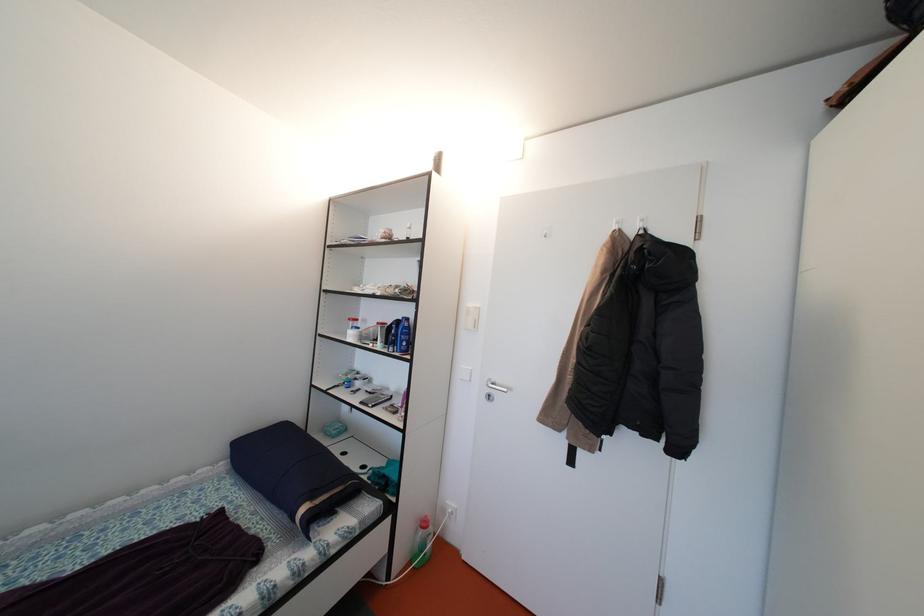
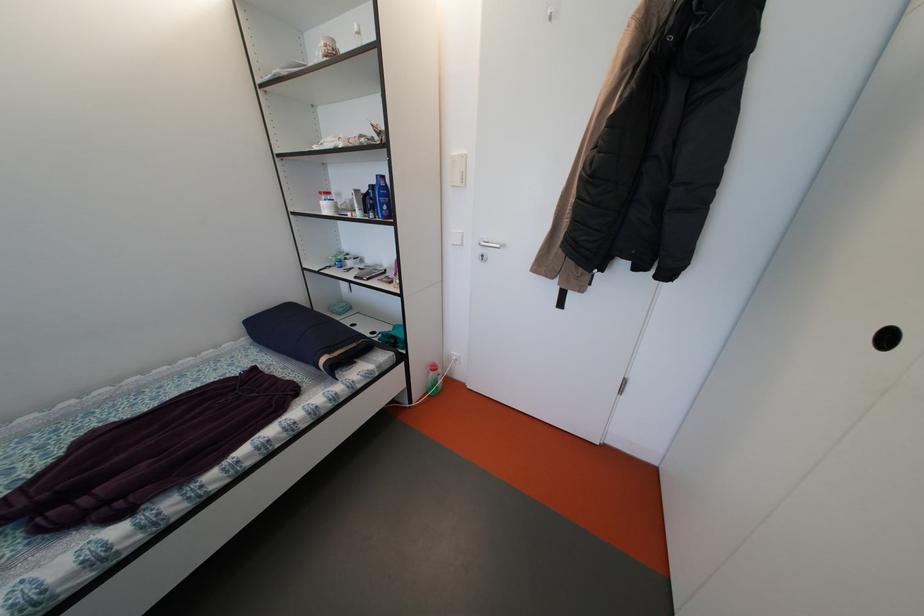
The point at (501, 386) is marked in the first image. Where is the corresponding point in the second image?

(493, 245)